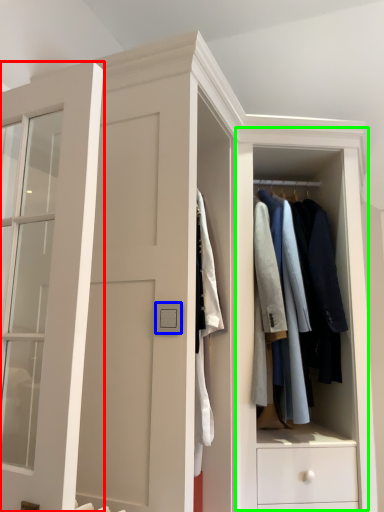
Question: Estimate the real-world distances between objects in this image. Which object is closer to door (highlighted by a red box), light switch (highlighted by a blue box) or dresser (highlighted by a green box)?

Choices:
 (A) light switch
 (B) dresser

Answer: (A)